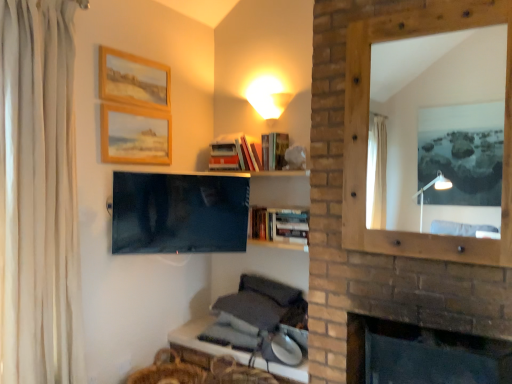
Question: Can you confirm if matte black tv at center is smaller than dark brick fireplace at lower right?

Choices:
 (A) no
 (B) yes

Answer: (B)

Question: Is matte black tv at center thinner than dark brick fireplace at lower right?

Choices:
 (A) yes
 (B) no

Answer: (A)

Question: Does matte black tv at center have a larger size compared to dark brick fireplace at lower right?

Choices:
 (A) no
 (B) yes

Answer: (A)

Question: Does matte black tv at center have a greater height compared to dark brick fireplace at lower right?

Choices:
 (A) yes
 (B) no

Answer: (A)

Question: Is matte black tv at center positioned with its back to dark brick fireplace at lower right?

Choices:
 (A) yes
 (B) no

Answer: (B)

Question: Is matte black tv at center not within dark brick fireplace at lower right?

Choices:
 (A) no
 (B) yes

Answer: (B)

Question: Is matte white cone at upper center shorter than wooden mirror at right?

Choices:
 (A) no
 (B) yes

Answer: (B)

Question: From the image's perspective, does matte white cone at upper center appear lower than wooden mirror at right?

Choices:
 (A) yes
 (B) no

Answer: (B)

Question: Are matte white cone at upper center and wooden mirror at right beside each other?

Choices:
 (A) no
 (B) yes

Answer: (A)

Question: Is matte white cone at upper center completely or partially outside of wooden mirror at right?

Choices:
 (A) no
 (B) yes

Answer: (B)

Question: From a real-world perspective, does matte white cone at upper center stand above wooden mirror at right?

Choices:
 (A) no
 (B) yes

Answer: (B)

Question: From a real-world perspective, is matte white cone at upper center under wooden mirror at right?

Choices:
 (A) no
 (B) yes

Answer: (A)

Question: Can you confirm if wooden table at lower center is taller than dark brick fireplace at lower right?

Choices:
 (A) yes
 (B) no

Answer: (B)